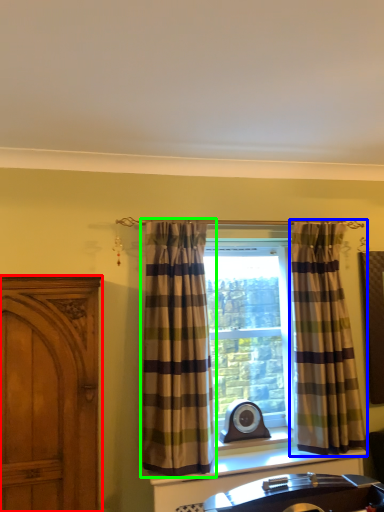
Question: Which object is the closest to the cabinetry (highlighted by a red box)? Choose among these: curtain (highlighted by a blue box) or curtain (highlighted by a green box).

Choices:
 (A) curtain
 (B) curtain

Answer: (B)